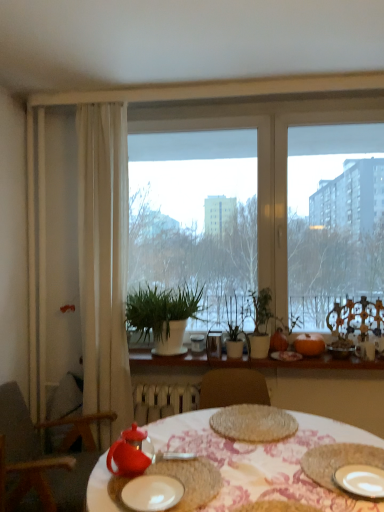
Find the location of a particular element. This screenshot has width=384, height=512. vacant space that is in between white matte plate at center, marked as the first plate in a left-to-right arrangement, and rustic woven placemat at lower right is located at coordinates (252, 480).